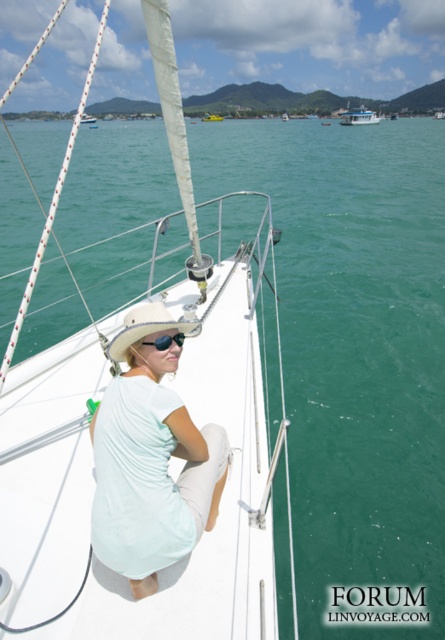
Can you confirm if light blue fabric dress at center is bigger than white matte boat at center?

Actually, light blue fabric dress at center might be smaller than white matte boat at center.

Does light blue fabric dress at center appear under white matte boat at center?

Indeed, light blue fabric dress at center is positioned under white matte boat at center.

Is point (116, 445) closer to camera compared to point (214, 120)?

Yes, it is in front of point (214, 120).

This screenshot has width=445, height=640. In order to click on light blue fabric dress at center in this screenshot , I will do (x=150, y=460).

Is white matte sailboat at center thinner than white matte boat at center?

Indeed, white matte sailboat at center has a lesser width compared to white matte boat at center.

Measure the distance between point [77,509] and camera.

A distance of 9.35 feet exists between point [77,509] and camera.

At what (x,y) coordinates should I click in order to perform the action: click on white matte sailboat at center. Please return your answer as a coordinate pair (x, y). The width and height of the screenshot is (445, 640). Looking at the image, I should click on (145, 444).

Between white matte sailboat at center and white matte sailboat at upper left, which one is positioned lower?

white matte sailboat at center is below.

Between point (242, 436) and point (94, 116), which one is positioned in front?

Positioned in front is point (242, 436).

Is point (152, 422) closer to camera compared to point (87, 116)?

Yes, it is.

Identify the location of white matte sailboat at center. (145, 444).